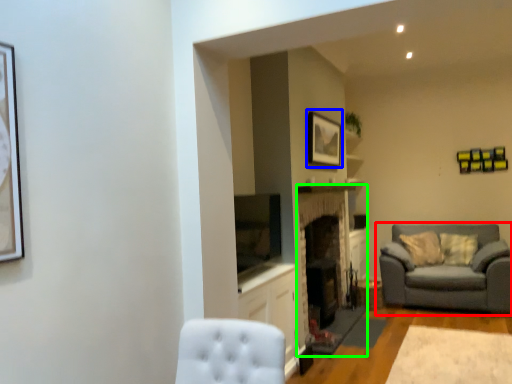
Question: Which object is the closest to the studio couch (highlighted by a red box)? Choose among these: picture frame (highlighted by a blue box) or fireplace (highlighted by a green box).

Choices:
 (A) picture frame
 (B) fireplace

Answer: (B)